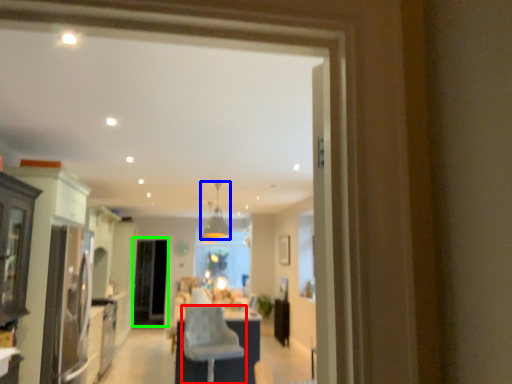
Question: Estimate the real-world distances between objects in this image. Which object is farther from chair (highlighted by a red box), light fixture (highlighted by a blue box) or screen door (highlighted by a green box)?

Choices:
 (A) light fixture
 (B) screen door

Answer: (B)